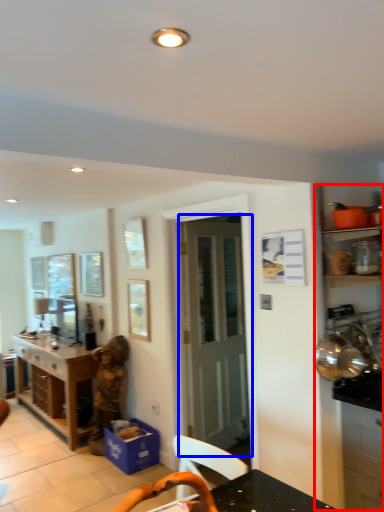
Question: Which object appears farthest to the camera in this image, dresser (highlighted by a red box) or door (highlighted by a blue box)?

Choices:
 (A) dresser
 (B) door

Answer: (B)